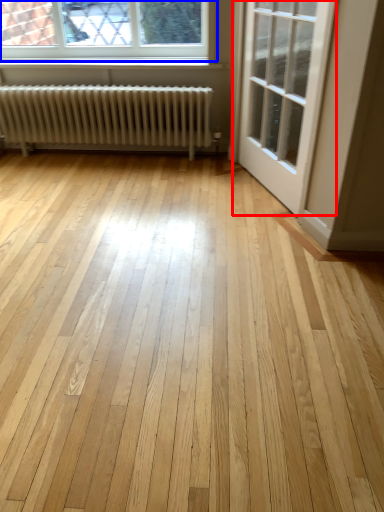
Question: Among these objects, which one is nearest to the camera, door (highlighted by a red box) or window (highlighted by a blue box)?

Choices:
 (A) door
 (B) window

Answer: (A)